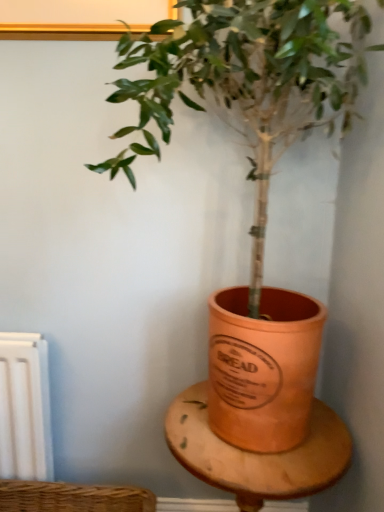
Question: Considering their positions, is terracotta pot at center located in front of or behind wooden table at center?

Choices:
 (A) front
 (B) behind

Answer: (A)

Question: From a real-world perspective, relative to wooden table at center, is terracotta pot at center vertically above or below?

Choices:
 (A) above
 (B) below

Answer: (A)

Question: Do you think terracotta pot at center is within wooden table at center, or outside of it?

Choices:
 (A) outside
 (B) inside

Answer: (A)

Question: From a real-world perspective, is wooden table at center physically located above or below terracotta pot at center?

Choices:
 (A) above
 (B) below

Answer: (B)

Question: From the image's perspective, is wooden table at center located above or below terracotta pot at center?

Choices:
 (A) below
 (B) above

Answer: (A)

Question: Is wooden table at center wider or thinner than terracotta pot at center?

Choices:
 (A) wide
 (B) thin

Answer: (B)

Question: Would you say wooden table at center is to the left or to the right of terracotta pot at center in the picture?

Choices:
 (A) right
 (B) left

Answer: (A)